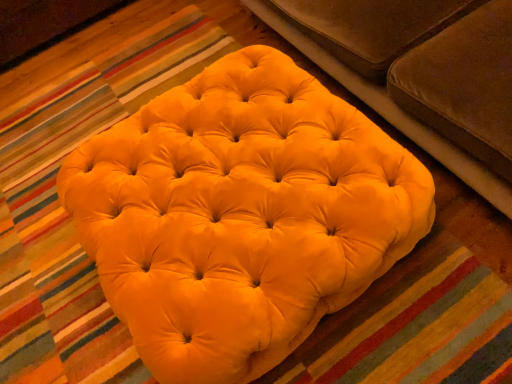
Question: Is the depth of matte yellow ottoman at center greater than that of velvet brown studio couch at upper center?

Choices:
 (A) yes
 (B) no

Answer: (A)

Question: Can you confirm if matte yellow ottoman at center is taller than velvet brown studio couch at upper center?

Choices:
 (A) yes
 (B) no

Answer: (B)

Question: Is matte yellow ottoman at center far away from velvet brown studio couch at upper center?

Choices:
 (A) yes
 (B) no

Answer: (B)

Question: Is matte yellow ottoman at center oriented towards velvet brown studio couch at upper center?

Choices:
 (A) yes
 (B) no

Answer: (B)

Question: Can you confirm if matte yellow ottoman at center is smaller than velvet brown studio couch at upper center?

Choices:
 (A) no
 (B) yes

Answer: (B)

Question: From a real-world perspective, is matte yellow ottoman at center over velvet brown studio couch at upper center?

Choices:
 (A) no
 (B) yes

Answer: (A)

Question: Does velvet brown studio couch at upper center have a larger size compared to matte yellow ottoman at center?

Choices:
 (A) yes
 (B) no

Answer: (A)

Question: Does velvet brown studio couch at upper center have a smaller size compared to matte yellow ottoman at center?

Choices:
 (A) no
 (B) yes

Answer: (A)

Question: Does velvet brown studio couch at upper center come in front of matte yellow ottoman at center?

Choices:
 (A) no
 (B) yes

Answer: (B)

Question: Can you confirm if velvet brown studio couch at upper center is thinner than matte yellow ottoman at center?

Choices:
 (A) yes
 (B) no

Answer: (B)

Question: Is velvet brown studio couch at upper center not inside matte yellow ottoman at center?

Choices:
 (A) no
 (B) yes

Answer: (B)

Question: Is velvet brown studio couch at upper center facing towards matte yellow ottoman at center?

Choices:
 (A) yes
 (B) no

Answer: (A)

Question: From the image's perspective, relative to matte yellow ottoman at center, is velvet brown studio couch at upper center above or below?

Choices:
 (A) above
 (B) below

Answer: (A)